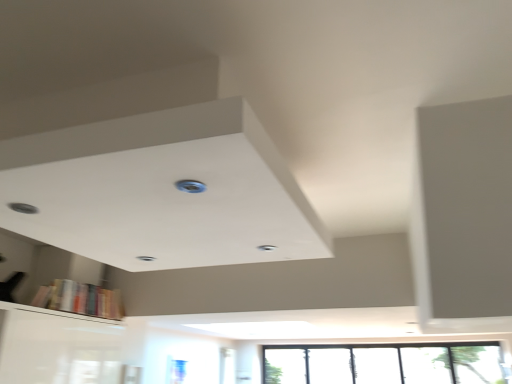
Question: Is hardcover books at lower left positioned before transparent glass window at lower right?

Choices:
 (A) yes
 (B) no

Answer: (A)

Question: Is hardcover books at lower left at the left side of transparent glass window at lower right?

Choices:
 (A) yes
 (B) no

Answer: (A)

Question: Is hardcover books at lower left facing away from transparent glass window at lower right?

Choices:
 (A) yes
 (B) no

Answer: (B)

Question: Is hardcover books at lower left located outside transparent glass window at lower right?

Choices:
 (A) yes
 (B) no

Answer: (A)

Question: From a real-world perspective, is hardcover books at lower left located beneath transparent glass window at lower right?

Choices:
 (A) yes
 (B) no

Answer: (B)

Question: Is there a large distance between hardcover books at lower left and transparent glass window at lower right?

Choices:
 (A) yes
 (B) no

Answer: (A)

Question: Is hardcover books at lower left oriented away from blue plastic hole at center?

Choices:
 (A) no
 (B) yes

Answer: (A)

Question: From a real-world perspective, is hardcover books at lower left under blue plastic hole at center?

Choices:
 (A) yes
 (B) no

Answer: (A)

Question: Does hardcover books at lower left have a greater width compared to blue plastic hole at center?

Choices:
 (A) yes
 (B) no

Answer: (A)

Question: Is hardcover books at lower left to the right of blue plastic hole at center from the viewer's perspective?

Choices:
 (A) yes
 (B) no

Answer: (B)

Question: Is the depth of hardcover books at lower left greater than that of blue plastic hole at center?

Choices:
 (A) yes
 (B) no

Answer: (A)

Question: Is the depth of hardcover books at lower left less than that of blue plastic hole at center?

Choices:
 (A) no
 (B) yes

Answer: (A)

Question: Is transparent glass window at lower right facing away from hardcover books at lower left?

Choices:
 (A) yes
 (B) no

Answer: (B)